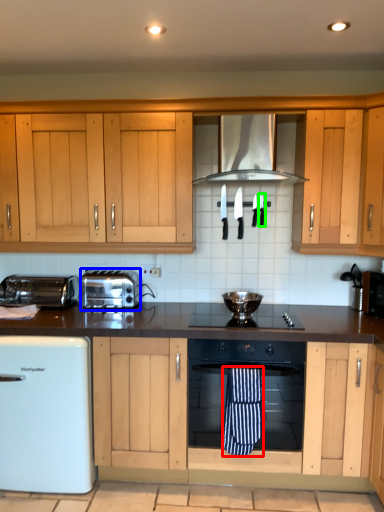
Question: Estimate the real-world distances between objects in this image. Which object is closer to beach towel (highlighted by a red box), toaster (highlighted by a blue box) or appliance (highlighted by a green box)?

Choices:
 (A) toaster
 (B) appliance

Answer: (A)